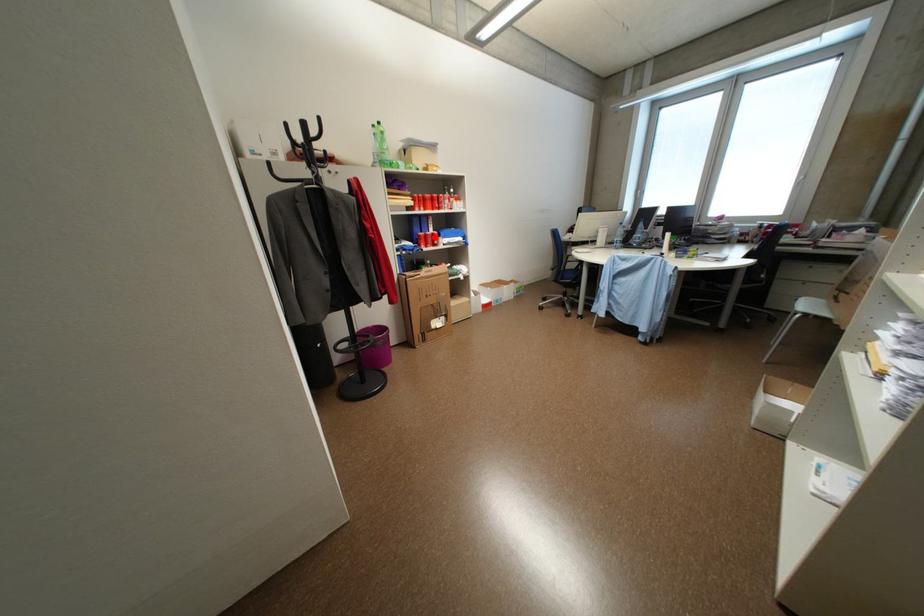
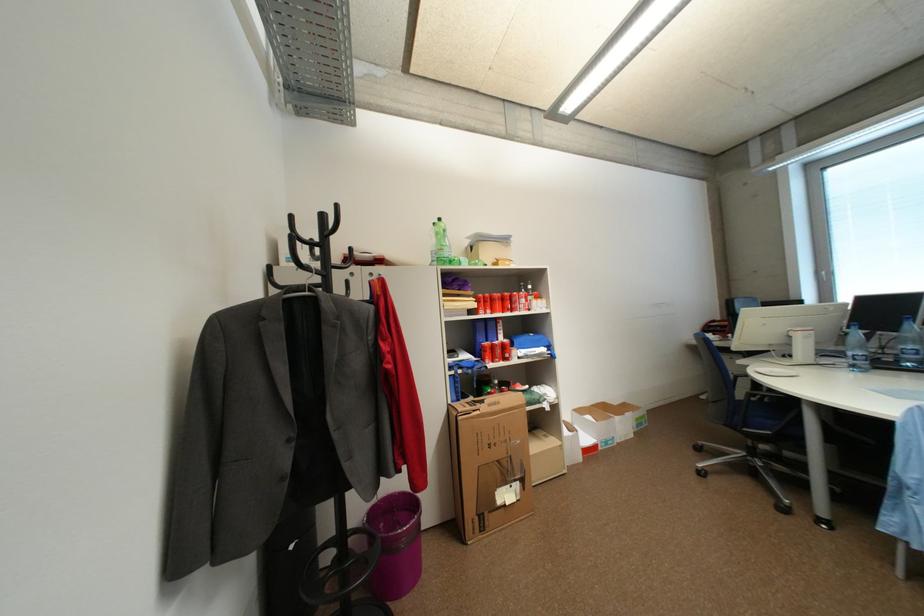
Find the pixel in the second image that matches the highlighted location in the first image.

(502, 347)